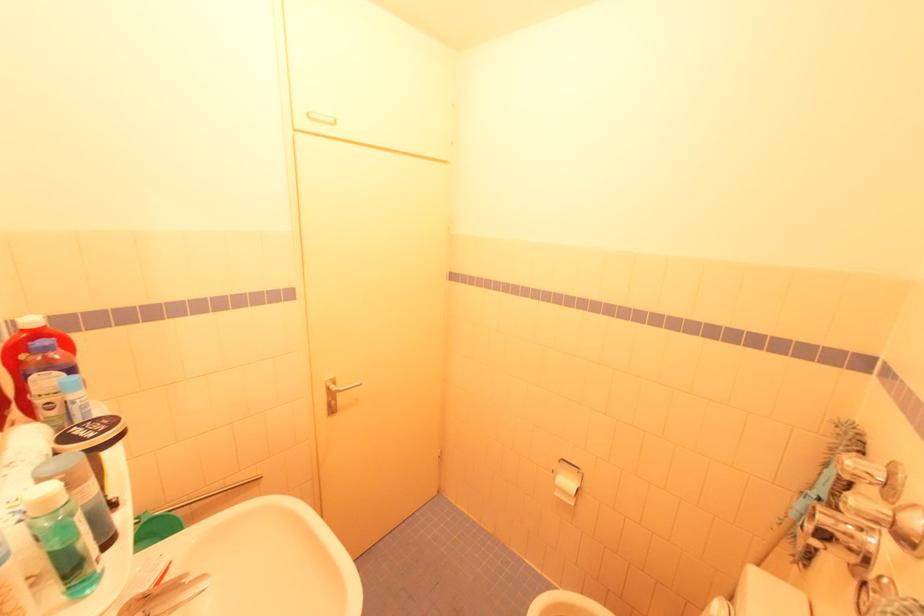
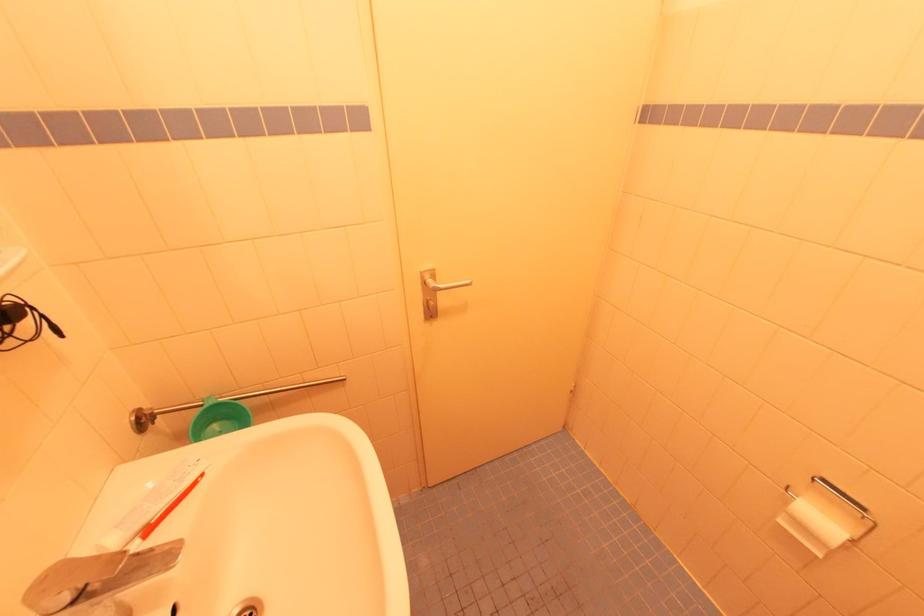
Find the pixel in the second image that matches the point at 557,495 in the first image.

(784, 523)